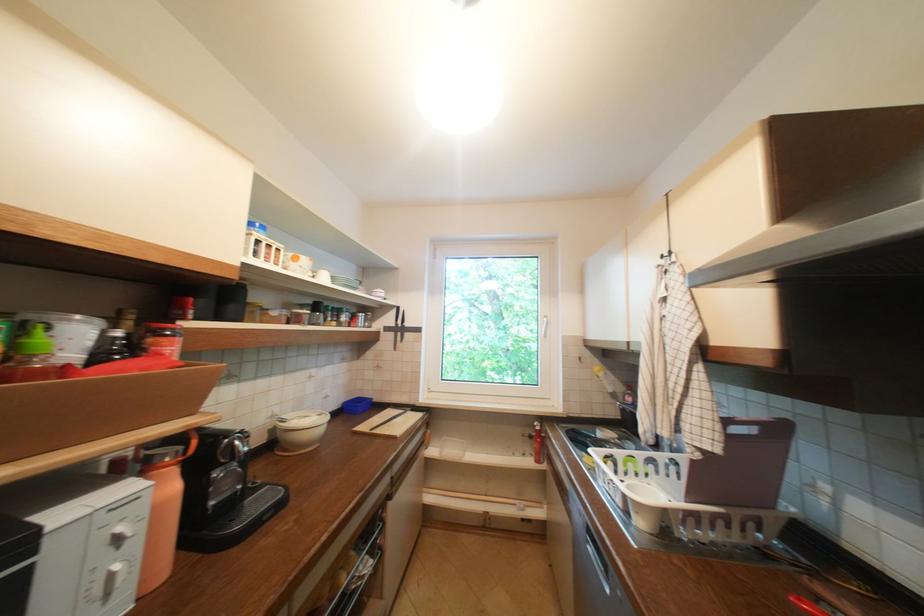
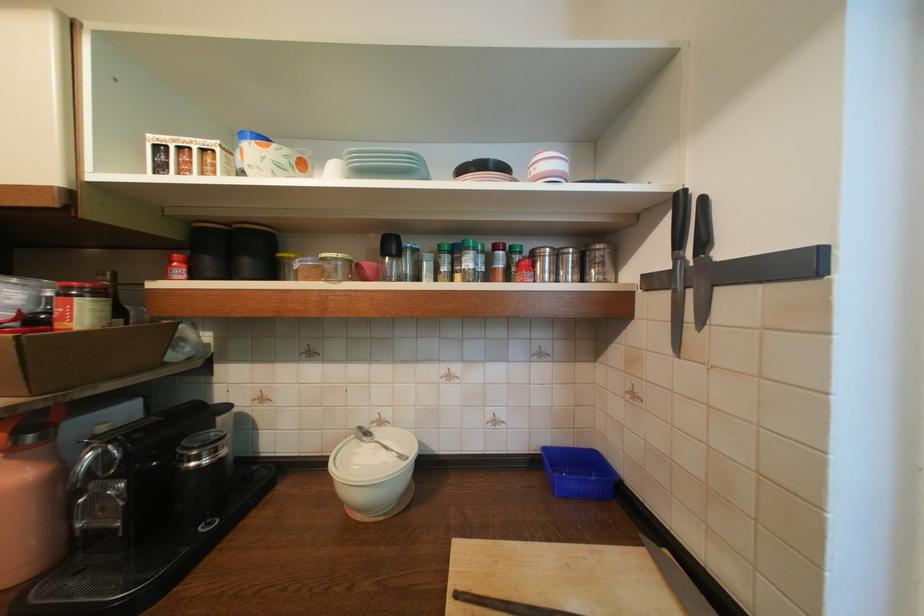
The point at (192, 318) is marked in the first image. Where is the corresponding point in the second image?

(174, 278)